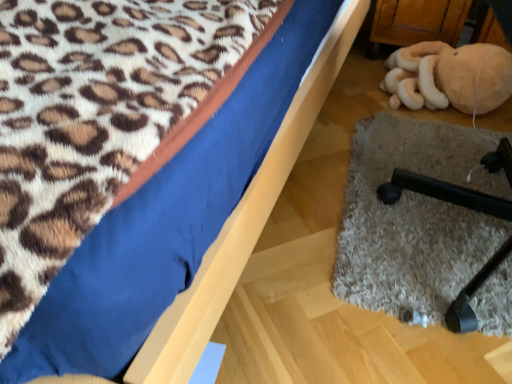
Question: Can you confirm if beige plush toy at lower right is bigger than black rubber chair leg at lower right?

Choices:
 (A) no
 (B) yes

Answer: (B)

Question: Is black rubber chair leg at lower right inside beige plush toy at lower right?

Choices:
 (A) no
 (B) yes

Answer: (A)

Question: Does beige plush toy at lower right have a greater height compared to black rubber chair leg at lower right?

Choices:
 (A) no
 (B) yes

Answer: (B)

Question: Is beige plush toy at lower right positioned far away from black rubber chair leg at lower right?

Choices:
 (A) no
 (B) yes

Answer: (A)

Question: Is beige plush toy at lower right outside of black rubber chair leg at lower right?

Choices:
 (A) yes
 (B) no

Answer: (A)

Question: Considering the positions of blue fabric bed at upper left and black rubber chair leg at lower right in the image, is blue fabric bed at upper left wider or thinner than black rubber chair leg at lower right?

Choices:
 (A) wide
 (B) thin

Answer: (A)

Question: Is blue fabric bed at upper left taller or shorter than black rubber chair leg at lower right?

Choices:
 (A) tall
 (B) short

Answer: (B)

Question: From a real-world perspective, is blue fabric bed at upper left physically located above or below black rubber chair leg at lower right?

Choices:
 (A) above
 (B) below

Answer: (B)

Question: Is blue fabric bed at upper left inside or outside of black rubber chair leg at lower right?

Choices:
 (A) inside
 (B) outside

Answer: (B)

Question: From the image's perspective, is blue fabric bed at upper left positioned above or below beige plush toy at lower right?

Choices:
 (A) above
 (B) below

Answer: (B)

Question: From their relative heights in the image, would you say blue fabric bed at upper left is taller or shorter than beige plush toy at lower right?

Choices:
 (A) tall
 (B) short

Answer: (B)

Question: Would you say blue fabric bed at upper left is to the left or to the right of beige plush toy at lower right in the picture?

Choices:
 (A) right
 (B) left

Answer: (B)

Question: Is blue fabric bed at upper left in front of or behind beige plush toy at lower right in the image?

Choices:
 (A) behind
 (B) front

Answer: (B)

Question: From the image's perspective, relative to black rubber chair leg at lower right, is beige plush toy at lower right above or below?

Choices:
 (A) above
 (B) below

Answer: (A)

Question: Considering the positions of beige plush toy at lower right and black rubber chair leg at lower right in the image, is beige plush toy at lower right wider or thinner than black rubber chair leg at lower right?

Choices:
 (A) wide
 (B) thin

Answer: (B)